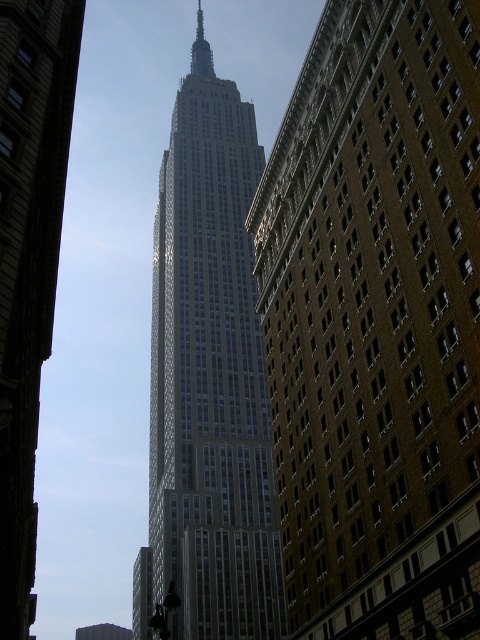
Is brick building at center further to the viewer compared to glassy steel skyscraper at center?

Yes, it is.

Is brick building at center positioned before glassy steel skyscraper at center?

No, it is not.

The width and height of the screenshot is (480, 640). Describe the element at coordinates (376, 323) in the screenshot. I see `brick building at center` at that location.

Identify the location of brick building at center. The image size is (480, 640). (376, 323).